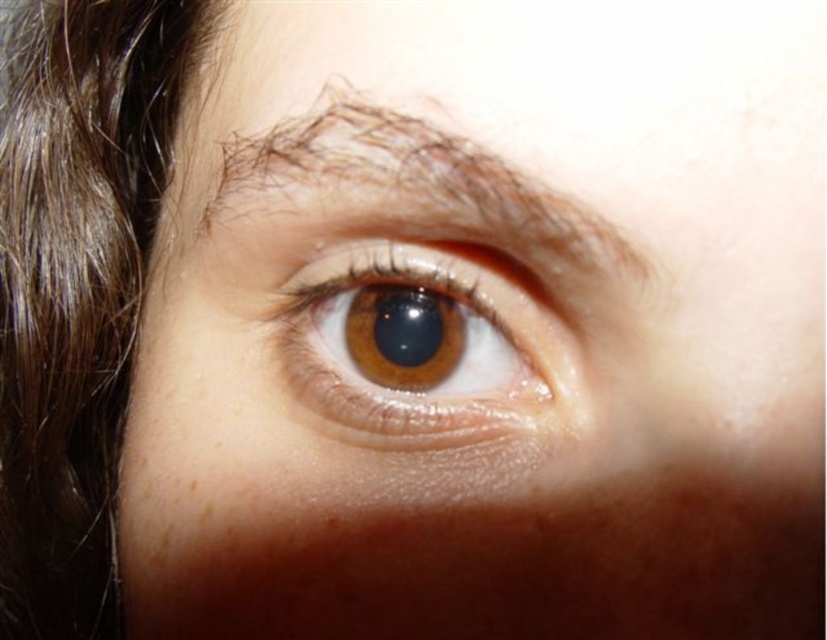
Can you confirm if brown shiny hair at left is positioned below brown hair at upper center?

No.

What do you see at coordinates (75, 285) in the screenshot? The width and height of the screenshot is (827, 640). I see `brown shiny hair at left` at bounding box center [75, 285].

What do you see at coordinates (75, 285) in the screenshot? This screenshot has height=640, width=827. I see `brown shiny hair at left` at bounding box center [75, 285].

Locate an element on the screen. The image size is (827, 640). brown shiny hair at left is located at coordinates (75, 285).

Can you confirm if brown shiny hair at left is wider than brown matte eye at center?

Yes, brown shiny hair at left is wider than brown matte eye at center.

You are a GUI agent. You are given a task and a screenshot of the screen. Output one action in this format:
    pyautogui.click(x=<x>, y=<y>)
    Task: Click on the brown shiny hair at left
    The height and width of the screenshot is (640, 827).
    Given the screenshot: What is the action you would take?
    pyautogui.click(x=75, y=285)

Does brown matte eye at center have a lesser width compared to brown hair at upper center?

Yes, brown matte eye at center is thinner than brown hair at upper center.

Can you confirm if brown matte eye at center is positioned above brown hair at upper center?

Incorrect, brown matte eye at center is not positioned above brown hair at upper center.

Who is more distant from viewer, (x=507, y=348) or (x=520, y=260)?

The point (x=507, y=348) is behind.

You are a GUI agent. You are given a task and a screenshot of the screen. Output one action in this format:
    pyautogui.click(x=<x>, y=<y>)
    Task: Click on the brown matte eye at center
    The image size is (827, 640).
    Given the screenshot: What is the action you would take?
    pyautogui.click(x=433, y=353)